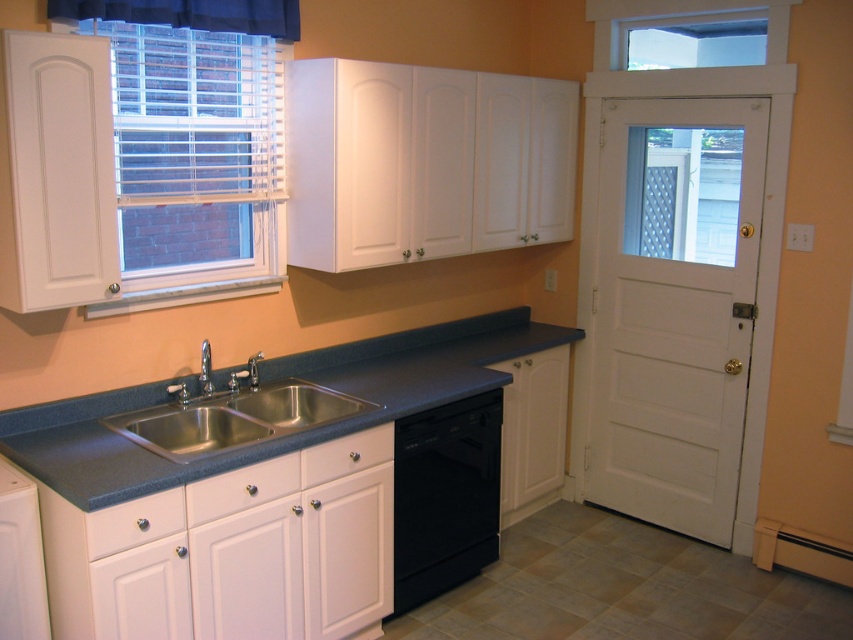
You are standing in the kitchen and want to adjust the black fabric curtain at upper left. If your arm reaches 6 feet, can you reach it without moving closer?

The black fabric curtain at upper left is 8.06 feet away from the viewer. Since your arm can only reach 6 feet, you cannot reach it without moving closer.